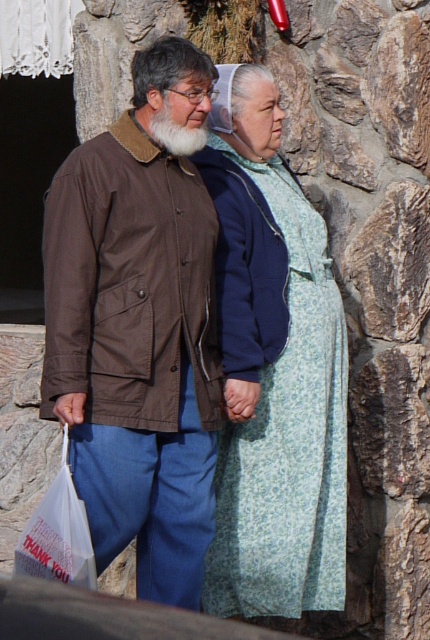
Question: Among these points, which one is nearest to the camera?

Choices:
 (A) (257, 490)
 (B) (110, 372)
 (C) (254, 385)

Answer: (B)

Question: Does white plastic bag at lower left have a greater width compared to white matte plastic bag at lower left?

Choices:
 (A) no
 (B) yes

Answer: (B)

Question: Is white plastic bag at lower left further to the viewer compared to white matte plastic bag at lower left?

Choices:
 (A) no
 (B) yes

Answer: (A)

Question: Can you confirm if white plastic bag at lower left is positioned above white matte plastic bag at lower left?

Choices:
 (A) no
 (B) yes

Answer: (A)

Question: Based on their relative distances, which object is farther from the smooth skin hand at center?

Choices:
 (A) light green floral dress at center
 (B) white plastic bag at lower left
 (C) brown fabric jacket at left
 (D) white matte plastic bag at lower left

Answer: (B)

Question: Which object appears closest to the camera in this image?

Choices:
 (A) white plastic bag at lower left
 (B) white matte plastic bag at lower left

Answer: (A)